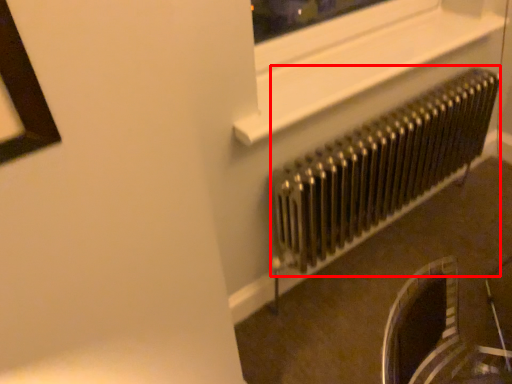
Question: From the image's perspective, what is the correct spatial relationship of radiator (annotated by the red box) in relation to window frame?

Choices:
 (A) above
 (B) below

Answer: (B)